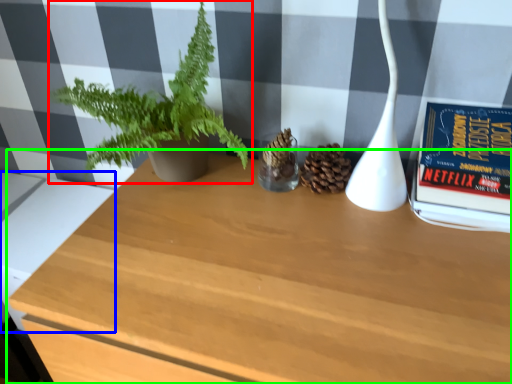
Question: Which object is the closest to the houseplant (highlighted by a red box)? Choose among these: table (highlighted by a blue box) or table (highlighted by a green box).

Choices:
 (A) table
 (B) table

Answer: (B)